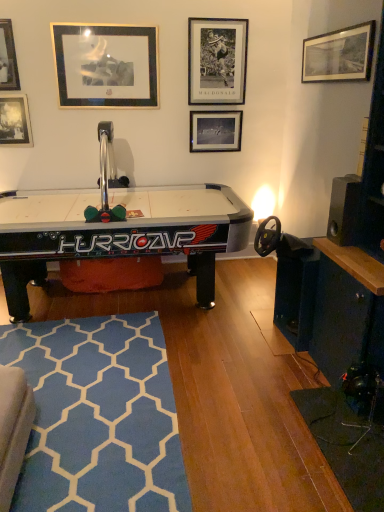
Question: Considering the relative positions of metallic silver picture frame at upper center, placed as the 2th picture frame when sorted from right to left, and blue textured rug at lower left in the image provided, is metallic silver picture frame at upper center, placed as the 2th picture frame when sorted from right to left, to the left or to the right of blue textured rug at lower left?

Choices:
 (A) left
 (B) right

Answer: (B)

Question: Considering the positions of metallic silver picture frame at upper center, placed as the 5th picture frame when sorted from left to right, and blue textured rug at lower left in the image, is metallic silver picture frame at upper center, placed as the 5th picture frame when sorted from left to right, wider or thinner than blue textured rug at lower left?

Choices:
 (A) thin
 (B) wide

Answer: (A)

Question: Estimate the real-world distances between objects in this image. Which object is closer to the gold/metallic picture frame at upper left, the third picture frame from the left?

Choices:
 (A) metallic silver picture frame at upper left, positioned as the 2th picture frame in left-to-right order
 (B) black matte picture frame at center, which ranks as the third picture frame in right-to-left order
 (C) black glossy air hockey table at center
 (D) metallic silver picture frame at upper left, arranged as the first picture frame when viewed from the left
 (E) blue textured rug at lower left

Answer: (A)

Question: Estimate the real-world distances between objects in this image. Which object is closer to the black matte picture frame at upper right, arranged as the 6th picture frame when viewed from the left?

Choices:
 (A) metallic silver picture frame at upper center, placed as the 5th picture frame when sorted from left to right
 (B) black glossy air hockey table at center
 (C) black matte picture frame at center, marked as the fourth picture frame in a left-to-right arrangement
 (D) metallic silver picture frame at upper left, which is the 6th picture frame from right to left
 (E) metallic silver picture frame at upper left, marked as the fifth picture frame in a right-to-left arrangement

Answer: (A)